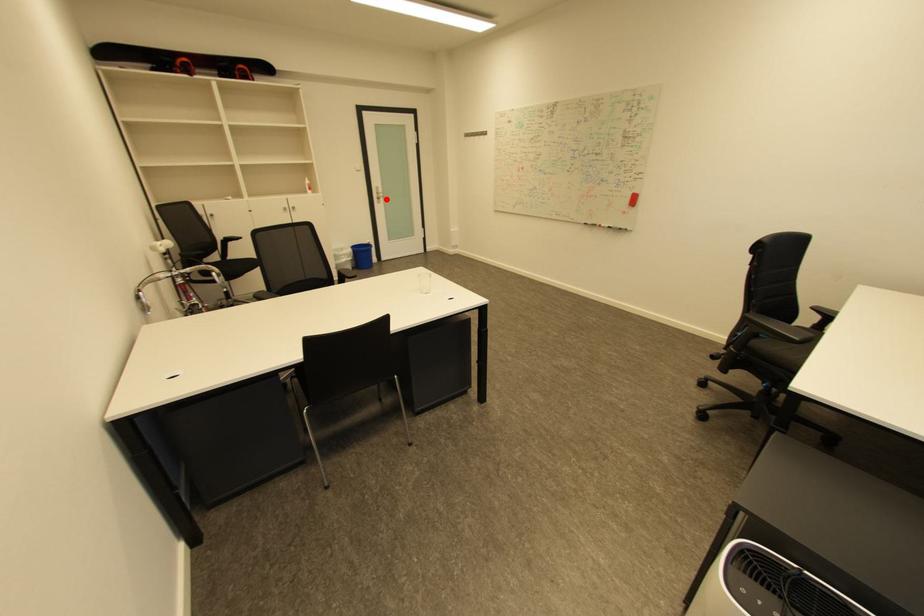
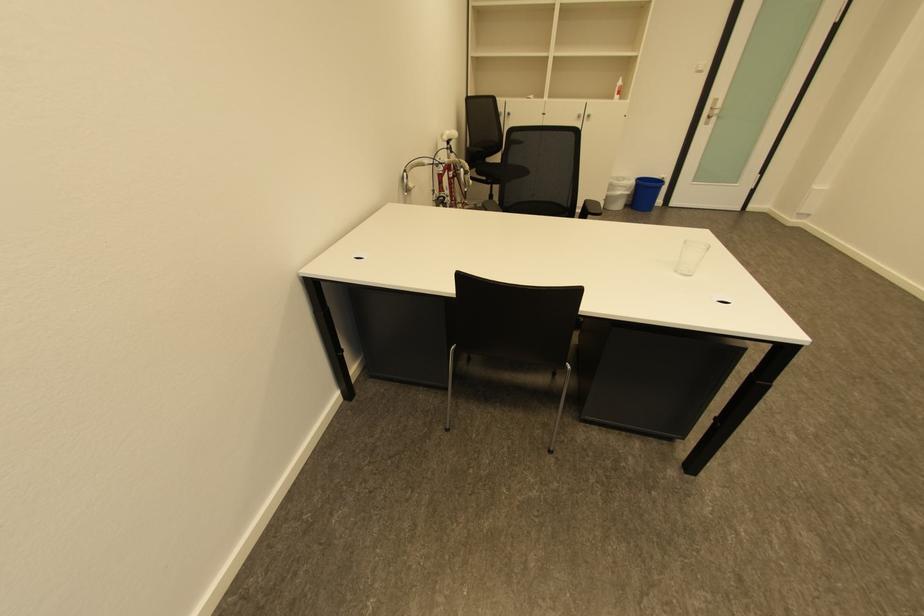
Question: I am providing you with two images of the same scene from different viewpoints. A red point is shown in image1. For the corresponding object point in image2, is it positioned nearer or farther from the camera?

Choices:
 (A) Nearer
 (B) Farther

Answer: (B)